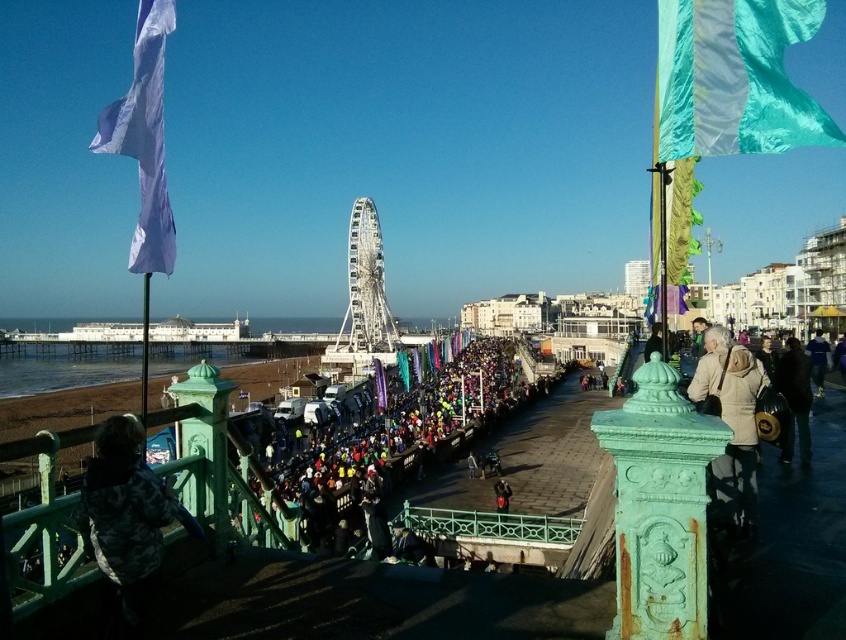
Question: Which point appears farthest from the camera in this image?

Choices:
 (A) (437, 417)
 (B) (795, 340)

Answer: (A)

Question: Which of the following is the closest to the observer?

Choices:
 (A) beige woolen jacket at right
 (B) multicolored fabric crowd at center
 (C) dark blue jacket at lower right
 (D) dark blue leather jacket at lower right

Answer: (A)

Question: Is the position of camouflage jacket at lower left more distant than that of dark blue jacket at lower right?

Choices:
 (A) yes
 (B) no

Answer: (B)

Question: Does dark blue leather jacket at lower right appear on the right side of dark blue jacket at lower right?

Choices:
 (A) yes
 (B) no

Answer: (B)

Question: Can you confirm if multicolored fabric crowd at center is smaller than dark blue jacket at lower right?

Choices:
 (A) no
 (B) yes

Answer: (A)

Question: Which object is the closest to the smooth concrete dock at center?

Choices:
 (A) dark blue jacket at lower right
 (B) camouflage jacket at lower left
 (C) teal silk flag at upper right

Answer: (A)